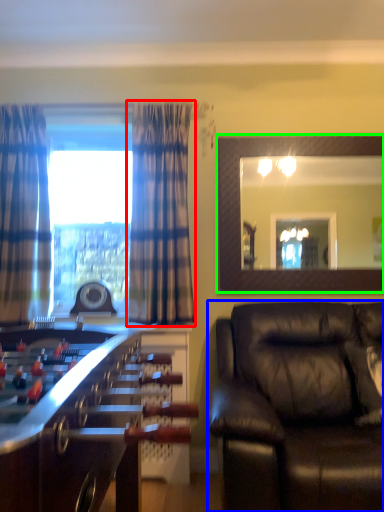
Question: Estimate the real-world distances between objects in this image. Which object is closer to curtain (highlighted by a red box), studio couch (highlighted by a blue box) or mirror (highlighted by a green box)?

Choices:
 (A) studio couch
 (B) mirror

Answer: (B)